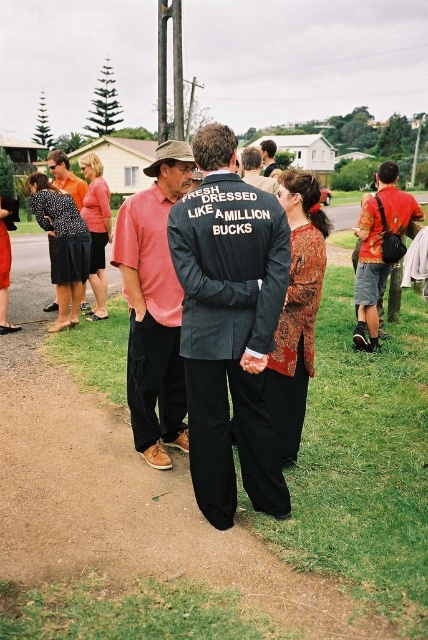
Question: Which point is farther from the camera taking this photo?

Choices:
 (A) (91, 461)
 (B) (83, 195)
 (C) (256, 506)

Answer: (B)

Question: Which of these objects is positioned farthest from the dark pinstripe suit at center?

Choices:
 (A) matte black jacket at center
 (B) matte black shirt at center
 (C) matte black suit at center

Answer: (B)

Question: Which point is closer to the camera?

Choices:
 (A) matte black shirt at center
 (B) dark pinstripe suit at center

Answer: (B)

Question: Does dirt path at center appear under dark gray suit at center?

Choices:
 (A) no
 (B) yes

Answer: (B)

Question: Can you confirm if reddish-brown fabric shirt at right is positioned below dark gray suit at center?

Choices:
 (A) yes
 (B) no

Answer: (A)

Question: Considering the relative positions of matte black shirt at center and matte black jacket at center in the image provided, where is matte black shirt at center located with respect to matte black jacket at center?

Choices:
 (A) below
 (B) above

Answer: (A)